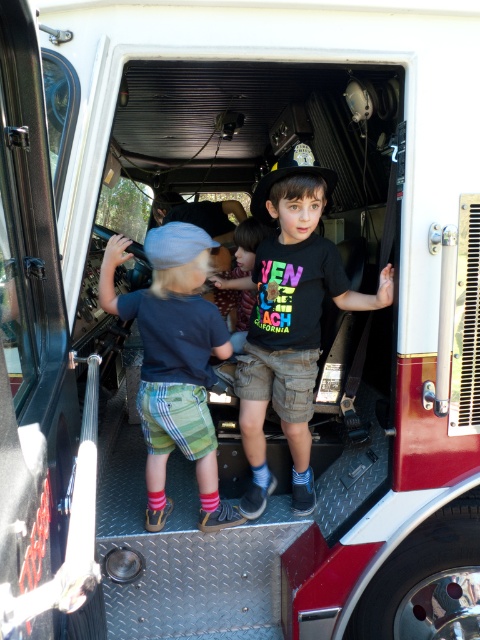
Looking at this image, you are a photographer trying to capture both the matte black shirt at center and the matte blue shirt at center in a single frame. Based on their sizes, which shirt should you focus on to ensure both are clearly visible?

The matte black shirt at center is larger in size than the matte blue shirt at center, so focusing on the matte black shirt at center would allow both shirts to be clearly visible in the photo.

You are a photographer trying to capture a photo of both the matte black shirt at center and the matte blue shirt at center in the fire truck. Based on their positions, which child should you focus on first to ensure both are in the frame?

The matte black shirt at center is wider than the matte blue shirt at center, so focusing on the matte black shirt at center first would ensure both are in the frame.